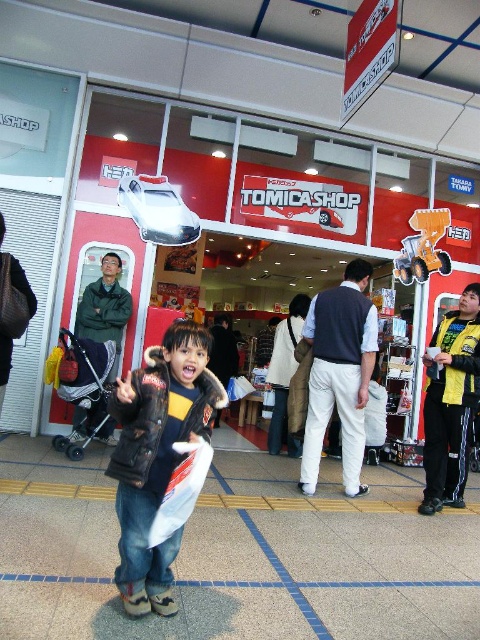
You are a customer at the TOMICASHOP store entrance. You see the white cotton pants at center and the yellow plastic construction vehicle at center. Which item would you need to reach for first if you want to pick up the smaller object?

The yellow plastic construction vehicle at center is smaller than the white cotton pants at center, so you would need to reach for the yellow plastic construction vehicle at center first.

You are a delivery person standing at the entrance of the store, and you need to place a dark brown leather jacket at center on a shelf inside. The shelf is 1.5 meters away from where you are standing. Can you reach the shelf without moving closer?

The dark brown leather jacket at center is 2.06 meters away from the camera, which is further than the 1.5 meters distance to the shelf. Therefore, you need to move closer to place the jacket on the shelf.

You are a store employee who needs to place the dark brown leather jacket at center and the white cotton pants at center on a display rack. The rack has a height limit of 1.2 meters. Can both items fit vertically on the rack if the jacket is 0.8 meters tall and the pants are 1.1 meters tall?

The dark brown leather jacket at center is 0.8 meters tall and the white cotton pants at center are 1.1 meters tall. Since the rack has a height limit of 1.2 meters, the pants alone would exceed the limit by 0.1 meters. Therefore, only the jacket can fit vertically on the rack.